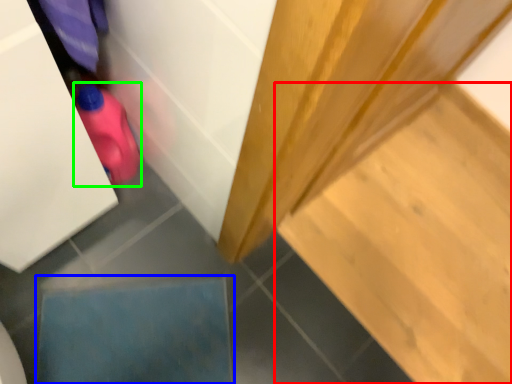
Question: Based on their relative distances, which object is nearer to stair (highlighted by a red box)? Choose from square (highlighted by a blue box) and stuff (highlighted by a green box).

Choices:
 (A) square
 (B) stuff

Answer: (A)